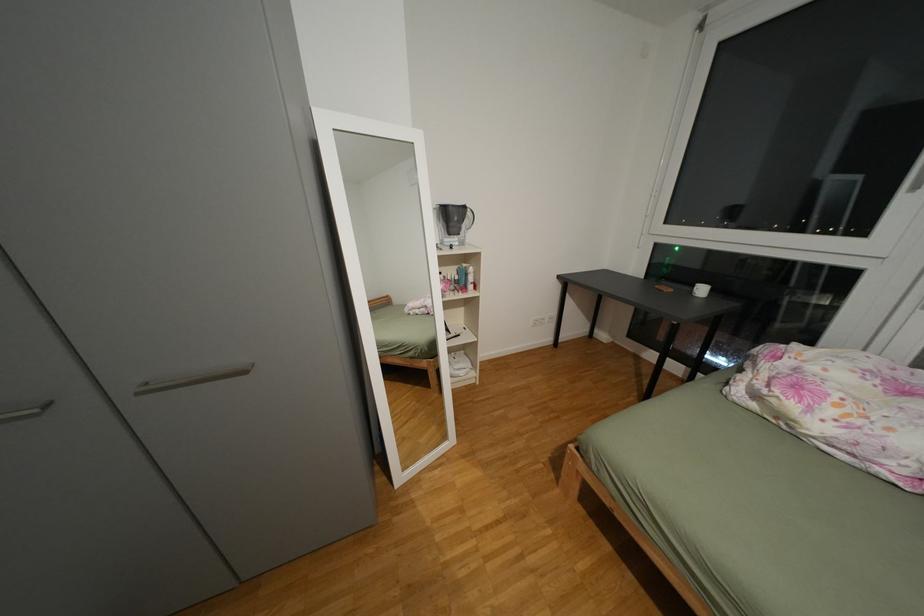
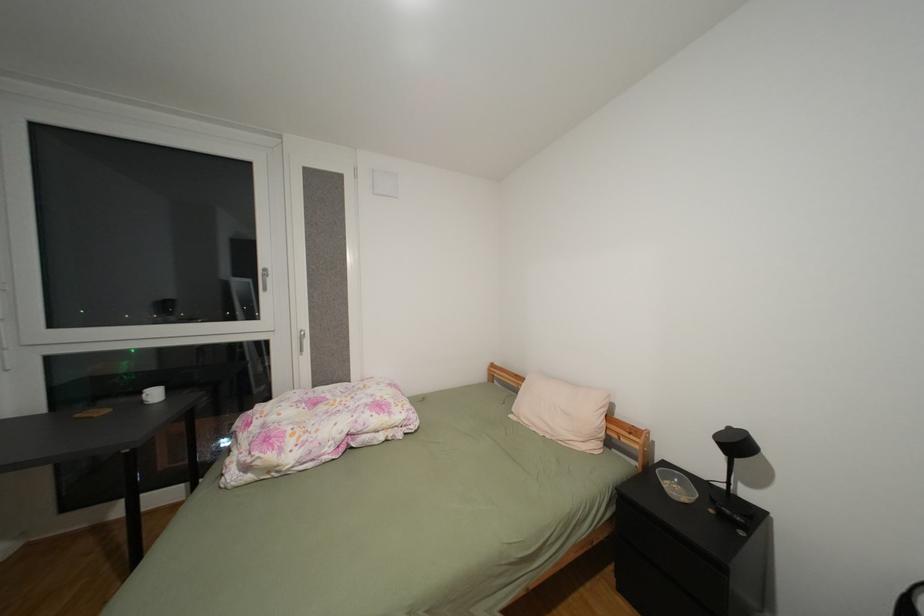
Question: The images are taken continuously from a first-person perspective. In which direction is your viewpoint rotating?

Choices:
 (A) Left
 (B) Right
 (C) Up
 (D) Down

Answer: (B)